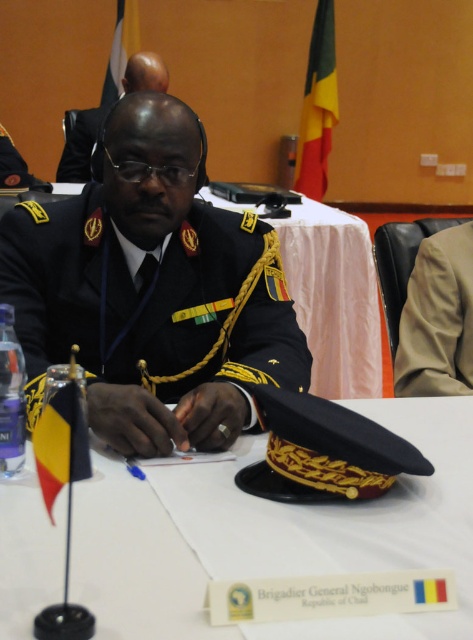
Question: Among these points, which one is farthest from the camera?

Choices:
 (A) (252, 296)
 (B) (164, 67)

Answer: (B)

Question: Which of the following is the farthest from the observer?

Choices:
 (A) white paper at center
 (B) beige fabric jacket at right
 (C) black uniform at center
 (D) black matte uniform at center

Answer: (C)

Question: Is black matte uniform at center positioned at the back of black uniform at center?

Choices:
 (A) yes
 (B) no

Answer: (B)

Question: From the image, what is the correct spatial relationship of white paper at center in relation to black uniform at center?

Choices:
 (A) right
 (B) left

Answer: (A)

Question: Among these objects, which one is nearest to the camera?

Choices:
 (A) black matte uniform at center
 (B) beige fabric jacket at right
 (C) black uniform at center
 (D) white paper at center

Answer: (D)

Question: Does white paper at center come behind beige fabric jacket at right?

Choices:
 (A) yes
 (B) no

Answer: (B)